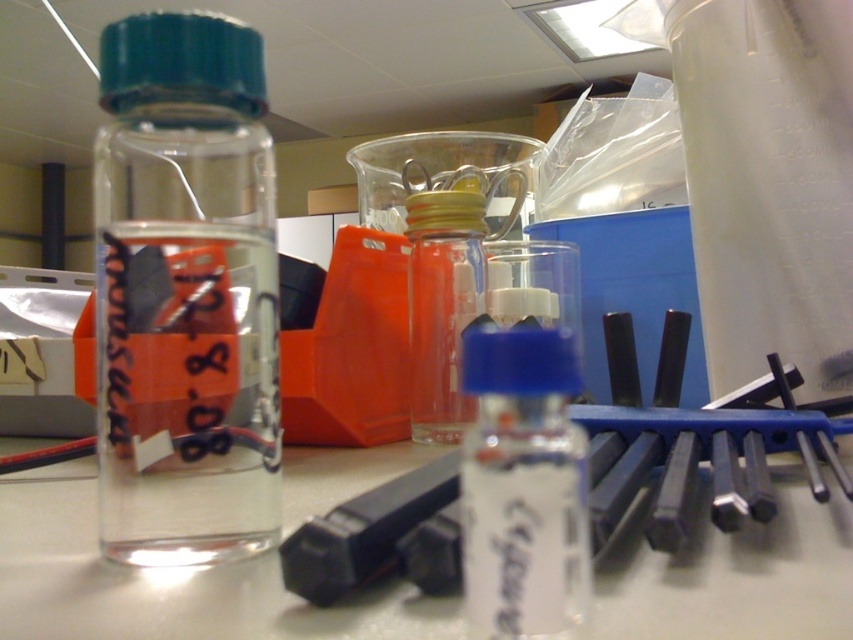
You are a researcher in the lab who needs to retrieve the transparent plastic vial at center for an experiment. The lab safety protocol requires that you must stay at least 12 inches away from all equipment to prevent contamination. Can you safely retrieve the vial without violating the protocol?

The transparent plastic vial at center is 6.27 inches from the camera, which is less than the required 12 inches distance. Therefore, you cannot safely retrieve it without violating the lab safety protocol.

You are a researcher in the lab and need to place the transparent plastic vial at center on the transparent glass table at center. Based on their sizes, will the vial fit on the table?

The transparent glass table at center is shorter than the transparent plastic vial at center, so the vial will not fit on the table due to its height exceeding the table.

You are a lab technician who needs to store a new sample in the container that can hold more liquid. Based on the image, which container should you choose between the transparent plastic vial at center and the transparent glass bottle at center?

The transparent plastic vial at center has a larger size compared to the transparent glass bottle at center, so you should choose the transparent plastic vial at center to store the new sample as it can hold more liquid.